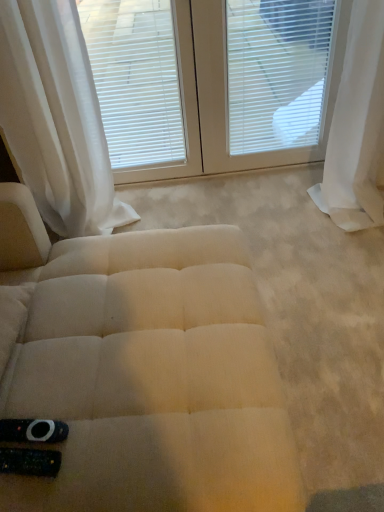
What is the approximate width of white textured blinds at upper center?

The width of white textured blinds at upper center is 1.94 inches.

The width and height of the screenshot is (384, 512). What do you see at coordinates (56, 118) in the screenshot?
I see `white sheer curtain at upper left, positioned as the second curtain in right-to-left order` at bounding box center [56, 118].

Measure the distance between point (100,130) and camera.

Point (100,130) and camera are 6.34 feet apart.

In order to face beige fabric ottoman at center, should I rotate leftwards or rightwards?

To face it directly, rotate right by 4.623 degrees.

This screenshot has width=384, height=512. What do you see at coordinates (146, 370) in the screenshot? I see `beige fabric ottoman at center` at bounding box center [146, 370].

Locate an element on the screen. white sheer curtain at right, the first curtain viewed from the right is located at coordinates (356, 126).

At what (x,y) coordinates should I click in order to perform the action: click on white matte window blind at upper center. Please return your answer as a coordinate pair (x, y). The height and width of the screenshot is (512, 384). Looking at the image, I should click on (135, 79).

Does white textured blinds at upper center have a smaller size compared to white matte window blind at upper center?

Indeed, white textured blinds at upper center has a smaller size compared to white matte window blind at upper center.

From the picture: Considering the positions of objects white textured blinds at upper center and white matte window blind at upper center in the image provided, who is more to the left, white textured blinds at upper center or white matte window blind at upper center?

white matte window blind at upper center is more to the left.

How far apart are white textured blinds at upper center and white matte window blind at upper center?

white textured blinds at upper center and white matte window blind at upper center are 6.25 inches apart.

Considering the relative sizes of white textured blinds at upper center and white matte window blind at upper center in the image provided, is white textured blinds at upper center thinner than white matte window blind at upper center?

Correct, the width of white textured blinds at upper center is less than that of white matte window blind at upper center.

Who is smaller, white matte window blind at upper center or white plastic blinds at upper center?

white matte window blind at upper center is smaller.

Looking at this image, from the image's perspective, between white matte window blind at upper center and white plastic blinds at upper center, who is located below?

white matte window blind at upper center.

Where is `blind on the right of white matte window blind at upper center`? This screenshot has height=512, width=384. blind on the right of white matte window blind at upper center is located at coordinates (276, 72).

Could you tell me if white sheer curtain at right, the first curtain viewed from the right, is facing white plastic blinds at upper center?

No, white sheer curtain at right, the first curtain viewed from the right, is not facing towards white plastic blinds at upper center.

Considering the relative sizes of white sheer curtain at right, the second curtain positioned from the left, and white plastic blinds at upper center in the image provided, is white sheer curtain at right, the second curtain positioned from the left, smaller than white plastic blinds at upper center?

Actually, white sheer curtain at right, the second curtain positioned from the left, might be larger than white plastic blinds at upper center.

Which point is more forward, (366, 207) or (328, 38)?

The point (328, 38) is more forward.

Considering the positions of point (67, 471) and point (35, 139), is point (67, 471) closer or farther from the camera than point (35, 139)?

Clearly, point (67, 471) is closer to the camera than point (35, 139).

The width and height of the screenshot is (384, 512). In order to click on furniture on the right of white sheer curtain at upper left, placed as the 1th curtain when sorted from left to right in this screenshot , I will do `click(146, 370)`.

From a real-world perspective, does beige fabric ottoman at center sit lower than white sheer curtain at upper left, placed as the 1th curtain when sorted from left to right?

Yes, from a real-world perspective, beige fabric ottoman at center is under white sheer curtain at upper left, placed as the 1th curtain when sorted from left to right.

Between beige fabric ottoman at center and white sheer curtain at upper left, placed as the 1th curtain when sorted from left to right, which one has larger size?

white sheer curtain at upper left, placed as the 1th curtain when sorted from left to right, is bigger.

Locate an element on the screen. Image resolution: width=384 pixels, height=512 pixels. blind behind the beige fabric ottoman at center is located at coordinates (276, 72).

From the image's perspective, is white plastic blinds at upper center located above or below beige fabric ottoman at center?

From the image's perspective, white plastic blinds at upper center appears above beige fabric ottoman at center.

Based on the photo, looking at their sizes, would you say white plastic blinds at upper center is wider or thinner than beige fabric ottoman at center?

white plastic blinds at upper center is thinner than beige fabric ottoman at center.

Is white plastic blinds at upper center positioned before beige fabric ottoman at center?

No, white plastic blinds at upper center is further to the viewer.

Considering the relative sizes of white textured blinds at upper center and white sheer curtain at right, the first curtain viewed from the right, in the image provided, is white textured blinds at upper center shorter than white sheer curtain at right, the first curtain viewed from the right,?

No.

From the image's perspective, which one is positioned higher, white textured blinds at upper center or white sheer curtain at right, the first curtain viewed from the right?

white textured blinds at upper center.

Can you confirm if white textured blinds at upper center is wider than white sheer curtain at right, the second curtain positioned from the left?

In fact, white textured blinds at upper center might be narrower than white sheer curtain at right, the second curtain positioned from the left.

Visually, is white sheer curtain at upper left, placed as the 1th curtain when sorted from left to right, positioned to the left or to the right of white textured blinds at upper center?

From the image, it's evident that white sheer curtain at upper left, placed as the 1th curtain when sorted from left to right, is to the left of white textured blinds at upper center.

Between white sheer curtain at upper left, placed as the 1th curtain when sorted from left to right, and white textured blinds at upper center, which one has smaller size?

Smaller between the two is white textured blinds at upper center.

From the image's perspective, who appears lower, white sheer curtain at upper left, positioned as the second curtain in right-to-left order, or white textured blinds at upper center?

From the image's view, white sheer curtain at upper left, positioned as the second curtain in right-to-left order, is below.

Between white sheer curtain at upper left, placed as the 1th curtain when sorted from left to right, and white textured blinds at upper center, which one has larger width?

white sheer curtain at upper left, placed as the 1th curtain when sorted from left to right.

Locate an element on the screen. This screenshot has height=512, width=384. window blind below the white textured blinds at upper center (from the image's perspective) is located at coordinates (135, 79).

Locate an element on the screen. The width and height of the screenshot is (384, 512). window blind that appears on the left of white plastic blinds at upper center is located at coordinates (135, 79).

From the image, which object appears to be nearer to white sheer curtain at right, the second curtain positioned from the left, white sheer curtain at upper left, placed as the 1th curtain when sorted from left to right, or white textured blinds at upper center?

Based on the image, white textured blinds at upper center appears to be nearer to white sheer curtain at right, the second curtain positioned from the left.

From the image, which object appears to be farther from beige fabric ottoman at center, white plastic blinds at upper center or white textured blinds at upper center?

Based on the image, white plastic blinds at upper center appears to be further to beige fabric ottoman at center.

From the image, which object appears to be nearer to white sheer curtain at upper left, placed as the 1th curtain when sorted from left to right, beige fabric ottoman at center or white textured blinds at upper center?

white textured blinds at upper center is closer to white sheer curtain at upper left, placed as the 1th curtain when sorted from left to right.

Which object lies nearer to the anchor point beige fabric ottoman at center, white sheer curtain at upper left, positioned as the second curtain in right-to-left order, or white sheer curtain at right, the second curtain positioned from the left?

Based on the image, white sheer curtain at upper left, positioned as the second curtain in right-to-left order, appears to be nearer to beige fabric ottoman at center.

Based on their spatial positions, is beige fabric ottoman at center or white matte window blind at upper center further from white sheer curtain at right, the second curtain positioned from the left?

beige fabric ottoman at center lies further to white sheer curtain at right, the second curtain positioned from the left, than the other object.

From the image, which object appears to be nearer to white textured blinds at upper center, white plastic blinds at upper center or white sheer curtain at upper left, positioned as the second curtain in right-to-left order?

The object closer to white textured blinds at upper center is white plastic blinds at upper center.

Based on their spatial positions, is white matte window blind at upper center or white plastic blinds at upper center closer to white textured blinds at upper center?

The object closer to white textured blinds at upper center is white plastic blinds at upper center.

Estimate the real-world distances between objects in this image. Which object is further from white sheer curtain at upper left, placed as the 1th curtain when sorted from left to right, beige fabric ottoman at center or white matte window blind at upper center?

beige fabric ottoman at center is further to white sheer curtain at upper left, placed as the 1th curtain when sorted from left to right.

Where is `bay window between white sheer curtain at upper left, positioned as the second curtain in right-to-left order, and white plastic blinds at upper center from left to right`? The width and height of the screenshot is (384, 512). bay window between white sheer curtain at upper left, positioned as the second curtain in right-to-left order, and white plastic blinds at upper center from left to right is located at coordinates (220, 84).

Where is `window blind situated between white sheer curtain at upper left, placed as the 1th curtain when sorted from left to right, and white textured blinds at upper center from left to right`? The width and height of the screenshot is (384, 512). window blind situated between white sheer curtain at upper left, placed as the 1th curtain when sorted from left to right, and white textured blinds at upper center from left to right is located at coordinates (135, 79).

Image resolution: width=384 pixels, height=512 pixels. Find the location of `window blind between white sheer curtain at upper left, placed as the 1th curtain when sorted from left to right, and white sheer curtain at right, the first curtain viewed from the right, in the horizontal direction`. window blind between white sheer curtain at upper left, placed as the 1th curtain when sorted from left to right, and white sheer curtain at right, the first curtain viewed from the right, in the horizontal direction is located at coordinates (135, 79).

Locate an element on the screen. This screenshot has height=512, width=384. bay window situated between white sheer curtain at upper left, positioned as the second curtain in right-to-left order, and white sheer curtain at right, the second curtain positioned from the left, from left to right is located at coordinates (220, 84).